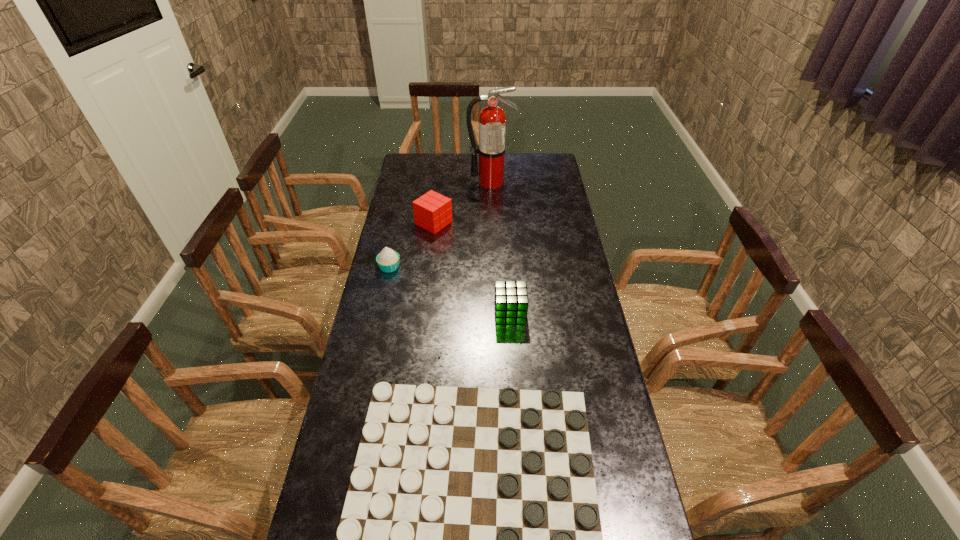
The image size is (960, 540). I want to click on vacant space situated 0.210m on the right of the cupcake, so click(x=457, y=267).

Identify the location of object situated at the far edge. The image size is (960, 540). (492, 120).

The image size is (960, 540). In order to click on cube that is at the left edge in this screenshot , I will do `click(432, 211)`.

At what (x,y) coordinates should I click in order to perform the action: click on cupcake positioned at the left edge. Please return your answer as a coordinate pair (x, y). Looking at the image, I should click on (388, 260).

At what (x,y) coordinates should I click in order to perform the action: click on vacant space at the far edge of the desktop. Please return your answer as a coordinate pair (x, y). This screenshot has width=960, height=540. Looking at the image, I should click on click(454, 173).

Where is `vacant space at the left edge of the desktop`? vacant space at the left edge of the desktop is located at coordinates (407, 266).

Identify the location of free point at the right edge. This screenshot has width=960, height=540. (559, 204).

Identify the location of vacant region at the far left corner of the desktop. (413, 163).

Identify the location of free space between the right cube and the cupcake. This screenshot has height=540, width=960. (449, 290).

Locate an element on the screen. The width and height of the screenshot is (960, 540). free space between the farthest object and the fourth nearest object is located at coordinates (462, 202).